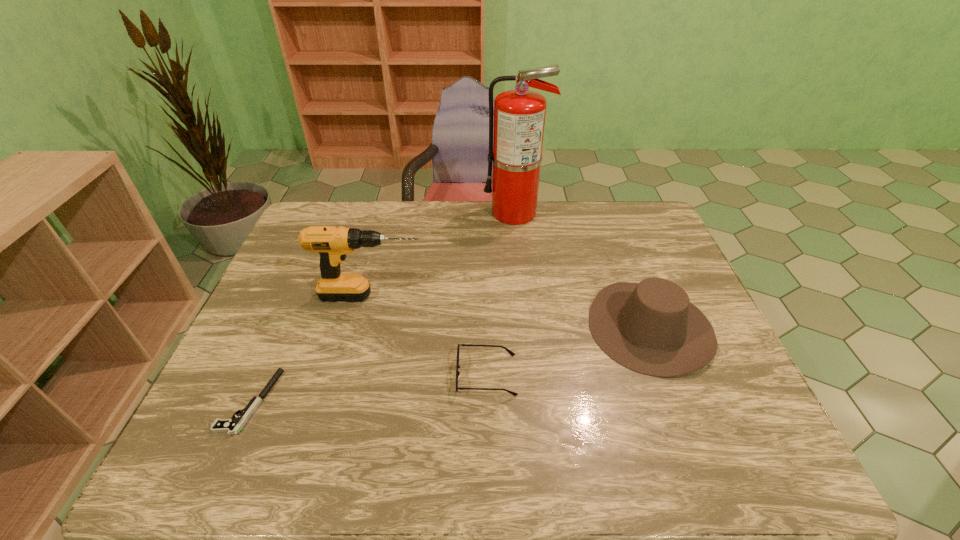
At what (x,y) coordinates should I click in order to perform the action: click on free space located at the nozzle of the tallest object. Please return your answer as a coordinate pair (x, y). Looking at the image, I should click on (375, 213).

The height and width of the screenshot is (540, 960). What are the coordinates of `vacant region located 0.380m at the nozzle of the tallest object` in the screenshot? It's located at (375, 213).

Find the location of a particular element. The height and width of the screenshot is (540, 960). free space located at the tip of the second tallest object is located at coordinates (552, 296).

This screenshot has width=960, height=540. Identify the location of free location located on the back of the rightmost object. (627, 265).

Find the location of a particular element. The image size is (960, 540). vacant space located 0.290m on the front-facing side of the spectacles is located at coordinates (334, 375).

At what (x,y) coordinates should I click in order to perform the action: click on free location located 0.150m on the front-facing side of the spectacles. Please return your answer as a coordinate pair (x, y). Looking at the image, I should click on (394, 375).

Identify the location of free space located on the front-facing side of the spectacles. (427, 375).

Where is `object that is positioned at the far edge`? Image resolution: width=960 pixels, height=540 pixels. object that is positioned at the far edge is located at coordinates (519, 115).

This screenshot has width=960, height=540. I want to click on object situated at the near edge, so click(x=232, y=426).

In order to click on drill located at the left edge in this screenshot , I will do `click(332, 243)`.